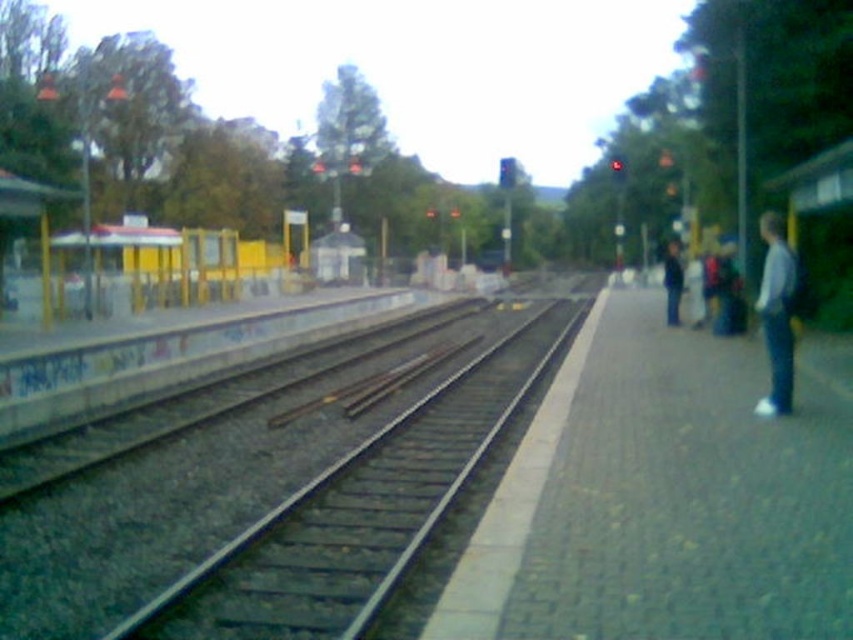
Question: Considering the real-world distances, which object is closest to the white fabric jacket at right?

Choices:
 (A) brick platform at right
 (B) dark blue jeans at right
 (C) smooth metal tracks at center

Answer: (A)

Question: Does brick platform at right have a larger size compared to white fabric jacket at right?

Choices:
 (A) no
 (B) yes

Answer: (B)

Question: Is smooth metal tracks at center to the right of dark blue jeans at right from the viewer's perspective?

Choices:
 (A) yes
 (B) no

Answer: (B)

Question: Estimate the real-world distances between objects in this image. Which object is farther from the white fabric jacket at right?

Choices:
 (A) smooth metal tracks at center
 (B) dark blue jeans at right

Answer: (B)

Question: Is the position of smooth metal tracks at center less distant than that of dark blue jeans at right?

Choices:
 (A) yes
 (B) no

Answer: (A)

Question: Which of the following is the farthest from the observer?

Choices:
 (A) smooth metal tracks at center
 (B) white fabric jacket at right

Answer: (B)